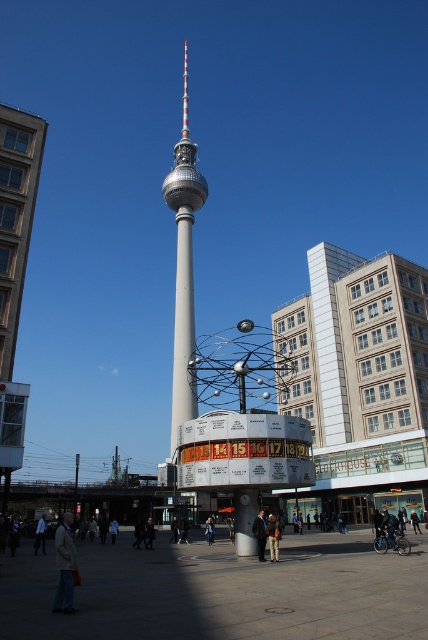
Question: Can you confirm if brown leather jacket at center is positioned below dark gray coat at center?

Choices:
 (A) yes
 (B) no

Answer: (B)

Question: From the image, what is the correct spatial relationship of silver metallic tower at center in relation to dark gray coat at center?

Choices:
 (A) above
 (B) below

Answer: (A)

Question: Estimate the real-world distances between objects in this image. Which object is farther from the brown leather jacket at center?

Choices:
 (A) light blue shirt at lower left
 (B) light blue fabric jacket at center
 (C) dark blue leather jacket at center
 (D) dark gray coat at center

Answer: (B)

Question: Which of the following is the closest to the observer?

Choices:
 (A) silver metallic tower at center
 (B) light blue shirt at lower left

Answer: (B)

Question: Considering the relative positions of brown leather jacket at center and dark gray coat at center in the image provided, where is brown leather jacket at center located with respect to dark gray coat at center?

Choices:
 (A) below
 (B) above

Answer: (B)

Question: Which is farther from the dark blue jacket at center?

Choices:
 (A) light gray jacket at lower left
 (B) dark gray coat at center
 (C) light blue fabric jacket at center

Answer: (A)